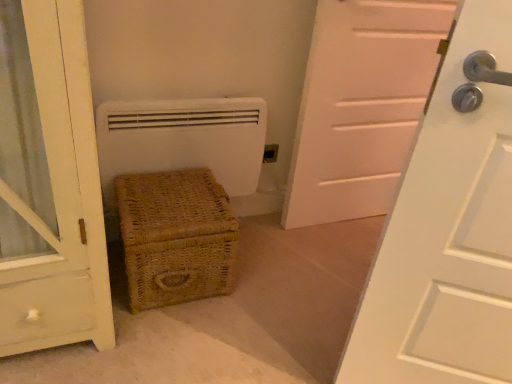
The image size is (512, 384). Describe the element at coordinates (182, 140) in the screenshot. I see `white matte heater at center` at that location.

What are the coordinates of `matte plastic electrical outlet at center` in the screenshot? It's located at (270, 153).

Measure the distance between point [133,211] and camera.

Point [133,211] is 4.33 feet from camera.

At what (x,y) coordinates should I click in order to perform the action: click on white matte heater at center. Please return your answer as a coordinate pair (x, y). Looking at the image, I should click on (182, 140).

In terms of width, does woven brown basket at lower left look wider or thinner when compared to white matte heater at center?

Considering their sizes, woven brown basket at lower left looks broader than white matte heater at center.

Does point (217, 259) lie behind point (174, 160)?

No, (217, 259) is closer to viewer.

Locate an element on the screen. furniture that appears on the left of white matte heater at center is located at coordinates (175, 236).

Which object is more forward, woven brown basket at lower left or white matte heater at center?

woven brown basket at lower left is closer to the camera.

From the image's perspective, does white matte door at center appear higher than white matte heater at center?

Yes.

Could you tell me if white matte door at center is facing white matte heater at center?

No, white matte door at center does not turn towards white matte heater at center.

Does white matte door at center have a smaller size compared to white matte heater at center?

No, white matte door at center is not smaller than white matte heater at center.

There is a white matte heater at center. Where is `door above it (from a real-world perspective)`? The width and height of the screenshot is (512, 384). door above it (from a real-world perspective) is located at coordinates (361, 105).

Considering the relative sizes of white matte heater at center and matte plastic electrical outlet at center in the image provided, is white matte heater at center thinner than matte plastic electrical outlet at center?

Incorrect, the width of white matte heater at center is not less than that of matte plastic electrical outlet at center.

In the scene shown: Is white matte heater at center positioned before matte plastic electrical outlet at center?

Yes, it is in front of matte plastic electrical outlet at center.

From the image's perspective, between matte plastic electrical outlet at center and white matte heater at center, which one is located above?

matte plastic electrical outlet at center is shown above in the image.

Does point (270, 144) appear closer or farther from the camera than point (185, 115)?

Point (270, 144) is positioned farther from the camera compared to point (185, 115).

From a real-world perspective, is matte plastic electrical outlet at center positioned above or below white matte heater at center?

Clearly, from a real-world perspective, matte plastic electrical outlet at center is below white matte heater at center.

Is matte plastic electrical outlet at center looking in the opposite direction of white matte heater at center?

No.

Considering the sizes of white matte heater at center and woven brown basket at lower left in the image, is white matte heater at center wider or thinner than woven brown basket at lower left?

white matte heater at center is thinner than woven brown basket at lower left.

Measure the distance between white matte heater at center and woven brown basket at lower left.

white matte heater at center is 21.24 centimeters away from woven brown basket at lower left.

Which object is positioned more to the left, white matte heater at center or woven brown basket at lower left?

Positioned to the left is woven brown basket at lower left.

Is white matte heater at center facing away from woven brown basket at lower left?

white matte heater at center does not have its back to woven brown basket at lower left.

Is white matte heater at center not within white matte door at center?

That's correct, white matte heater at center is outside of white matte door at center.

Considering the relative sizes of white matte heater at center and white matte door at center in the image provided, is white matte heater at center thinner than white matte door at center?

Correct, the width of white matte heater at center is less than that of white matte door at center.

Is white matte heater at center bigger than white matte door at center?

Actually, white matte heater at center might be smaller than white matte door at center.

From a real-world perspective, who is located lower, white matte heater at center or white matte door at center?

white matte heater at center.

Considering the relative sizes of white matte door at center and matte plastic electrical outlet at center in the image provided, is white matte door at center shorter than matte plastic electrical outlet at center?

No.

Does white matte door at center have a lesser width compared to matte plastic electrical outlet at center?

No, white matte door at center is not thinner than matte plastic electrical outlet at center.

Is white matte door at center aimed at matte plastic electrical outlet at center?

No, white matte door at center is not facing towards matte plastic electrical outlet at center.

Is white matte door at center at the left side of matte plastic electrical outlet at center?

No, white matte door at center is not to the left of matte plastic electrical outlet at center.

Find the location of a particular element. furniture that appears on the left of white matte heater at center is located at coordinates (175, 236).

In the image, there is a white matte door at center. At what (x,y) coordinates should I click in order to perform the action: click on heater below it (from a real-world perspective). Please return your answer as a coordinate pair (x, y). Looking at the image, I should click on (182, 140).

Consider the image. When comparing their distances from woven brown basket at lower left, does white matte heater at center or matte plastic electrical outlet at center seem further?

matte plastic electrical outlet at center is further to woven brown basket at lower left.

Looking at this image, which object lies further to the anchor point white matte heater at center, matte plastic electrical outlet at center or woven brown basket at lower left?

matte plastic electrical outlet at center is positioned further to the anchor white matte heater at center.

From the picture: Looking at the image, which one is located closer to matte plastic electrical outlet at center, white matte heater at center or white matte door at center?

white matte heater at center.

Based on their spatial positions, is woven brown basket at lower left or matte plastic electrical outlet at center further from white matte door at center?

Answer: woven brown basket at lower left is further to white matte door at center.

When comparing their distances from woven brown basket at lower left, does matte plastic electrical outlet at center or white matte door at center seem closer?

matte plastic electrical outlet at center is closer to woven brown basket at lower left.

Estimate the real-world distances between objects in this image. Which object is further from white matte heater at center, woven brown basket at lower left or matte plastic electrical outlet at center?

matte plastic electrical outlet at center is positioned further to the anchor white matte heater at center.

Which object lies nearer to the anchor point matte plastic electrical outlet at center, white matte door at center or white matte heater at center?

The object closer to matte plastic electrical outlet at center is white matte heater at center.

Based on their spatial positions, is white matte heater at center or woven brown basket at lower left closer to matte plastic electrical outlet at center?

Among the two, white matte heater at center is located nearer to matte plastic electrical outlet at center.

I want to click on electric outlet situated between woven brown basket at lower left and white matte door at center from left to right, so click(270, 153).

Image resolution: width=512 pixels, height=384 pixels. What are the coordinates of `electric outlet situated between white matte heater at center and white matte door at center from left to right` in the screenshot? It's located at (270, 153).

At what (x,y) coordinates should I click in order to perform the action: click on heater located between woven brown basket at lower left and white matte door at center in the left-right direction. Please return your answer as a coordinate pair (x, y). This screenshot has width=512, height=384. Looking at the image, I should click on (182, 140).

In order to click on heater between woven brown basket at lower left and matte plastic electrical outlet at center from front to back in this screenshot , I will do `click(182, 140)`.